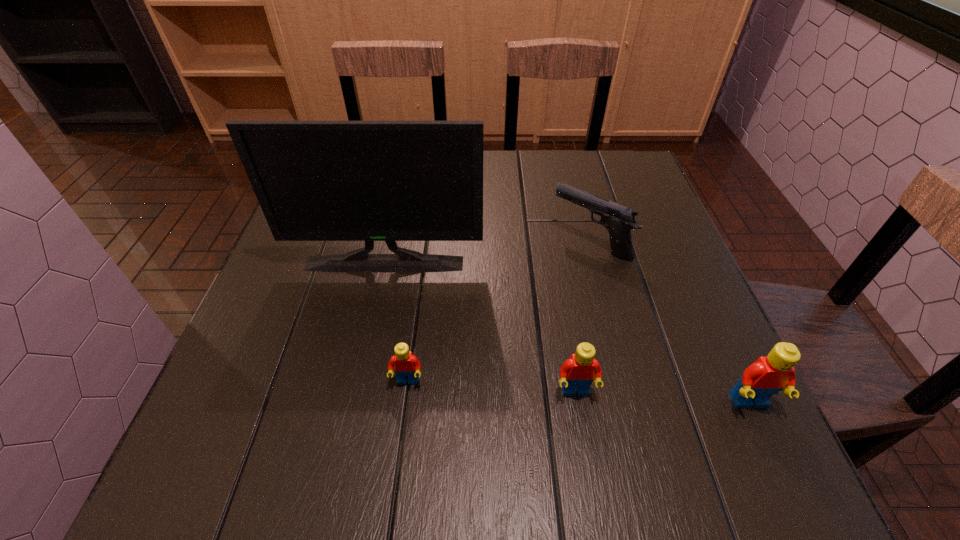
Identify the location of the shortest object. (406, 365).

Find the location of `the leftmost Lego`. the leftmost Lego is located at coordinates (406, 365).

Locate an element on the screen. The height and width of the screenshot is (540, 960). the second Lego from right to left is located at coordinates (578, 372).

Identify the location of the rightmost Lego. This screenshot has height=540, width=960. (768, 375).

Find the location of a particular element. Image resolution: width=960 pixels, height=540 pixels. the tallest Lego is located at coordinates (768, 375).

Find the location of a particular element. The height and width of the screenshot is (540, 960). gun is located at coordinates (619, 220).

Identify the location of the tallest object. (390, 181).

Locate an element on the screen. Image resolution: width=960 pixels, height=540 pixels. free spot located 0.390m at the muzzle of the gun is located at coordinates (385, 242).

The image size is (960, 540). I want to click on vacant region located 0.050m at the muzzle of the gun, so click(x=532, y=242).

Where is `free space located 0.390m at the muzzle of the gun`? free space located 0.390m at the muzzle of the gun is located at coordinates (385, 242).